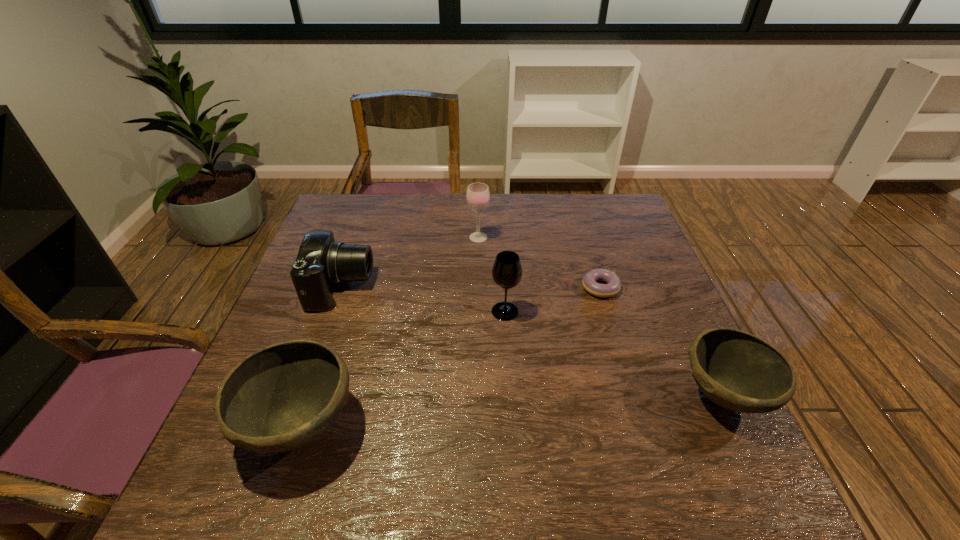
In order to click on free point between the taller bowl and the farthest object in this screenshot , I will do `click(390, 332)`.

Where is `vacant point located between the nearer wineglass and the shortest object`? The height and width of the screenshot is (540, 960). vacant point located between the nearer wineglass and the shortest object is located at coordinates (553, 299).

I want to click on free space between the farther wineglass and the camera, so click(x=410, y=262).

Locate an element on the screen. This screenshot has width=960, height=540. vacant space that's between the shortest object and the farther wineglass is located at coordinates (540, 262).

What are the coordinates of `vacant point located between the farther wineglass and the nearer wineglass` in the screenshot? It's located at (492, 274).

At what (x,y) coordinates should I click in order to perform the action: click on object that is the nearest to the farther wineglass. Please return your answer as a coordinate pair (x, y). The image size is (960, 540). Looking at the image, I should click on (507, 271).

Identify which object is the fifth closest to the nearer wineglass. Please provide its 2D coordinates. Your answer should be formatted as a tuple, i.e. [(x, y)], where the tuple contains the x and y coordinates of a point satisfying the conditions above.

[(736, 370)]

Locate an element on the screen. The height and width of the screenshot is (540, 960). vacant position in the image that satisfies the following two spatial constraints: 1. on the back side of the shortest object; 2. on the lens of the camera is located at coordinates (600, 287).

Find the location of a particular element. This screenshot has height=540, width=960. vacant region that satisfies the following two spatial constraints: 1. on the back side of the fifth object from left to right; 2. on the lens of the camera is located at coordinates (600, 287).

Locate an element on the screen. vacant area in the image that satisfies the following two spatial constraints: 1. on the lens of the camera; 2. on the right side of the nearer wineglass is located at coordinates (332, 311).